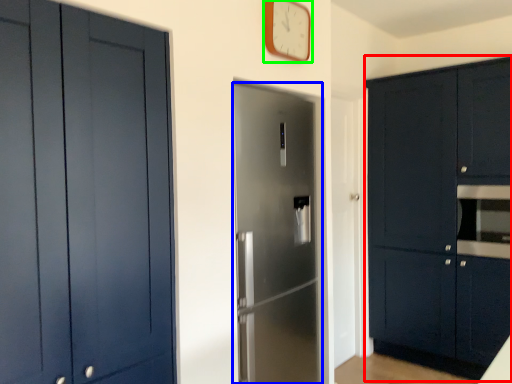
Question: Which is farther away from cabinetry (highlighted by a red box)? door (highlighted by a blue box) or clock (highlighted by a green box)?

Choices:
 (A) door
 (B) clock

Answer: (B)